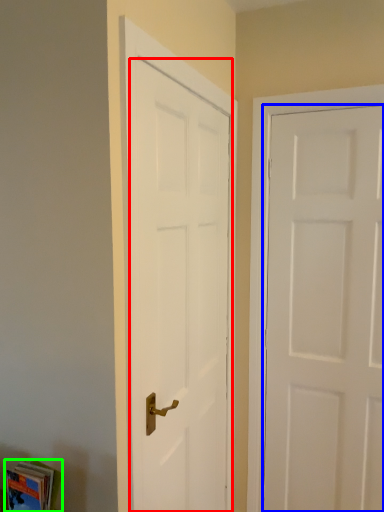
Question: Which is nearer to the door (highlighted by a red box)? door (highlighted by a blue box) or book (highlighted by a green box).

Choices:
 (A) door
 (B) book

Answer: (A)